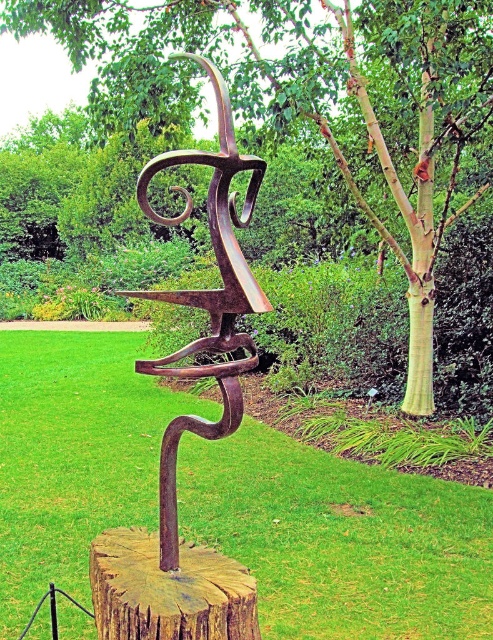
Does green wood tree at center appear on the left side of rusty metal sculpture at center?

No, green wood tree at center is not to the left of rusty metal sculpture at center.

Which is more to the right, green wood tree at center or rusty metal sculpture at center?

Positioned to the right is green wood tree at center.

Which is behind, point (308, 77) or point (201, 365)?

Point (308, 77)

Identify the location of green wood tree at center. (326, 93).

Who is more forward, (458, 67) or (103, 609)?

Point (103, 609) is more forward.

Who is positioned more to the left, green wood tree at center or wooden stump at center?

Positioned to the left is wooden stump at center.

Which is behind, point (393, 10) or point (111, 595)?

The point (393, 10) is behind.

Find the location of a particular element. The height and width of the screenshot is (640, 493). green wood tree at center is located at coordinates (326, 93).

Is rusty metal sculpture at center positioned before wooden stump at center?

That is True.

Can you confirm if rusty metal sculpture at center is shorter than wooden stump at center?

In fact, rusty metal sculpture at center may be taller than wooden stump at center.

Locate an element on the screen. This screenshot has height=640, width=493. rusty metal sculpture at center is located at coordinates (207, 300).

Identify the location of rusty metal sculpture at center. This screenshot has width=493, height=640. (207, 300).